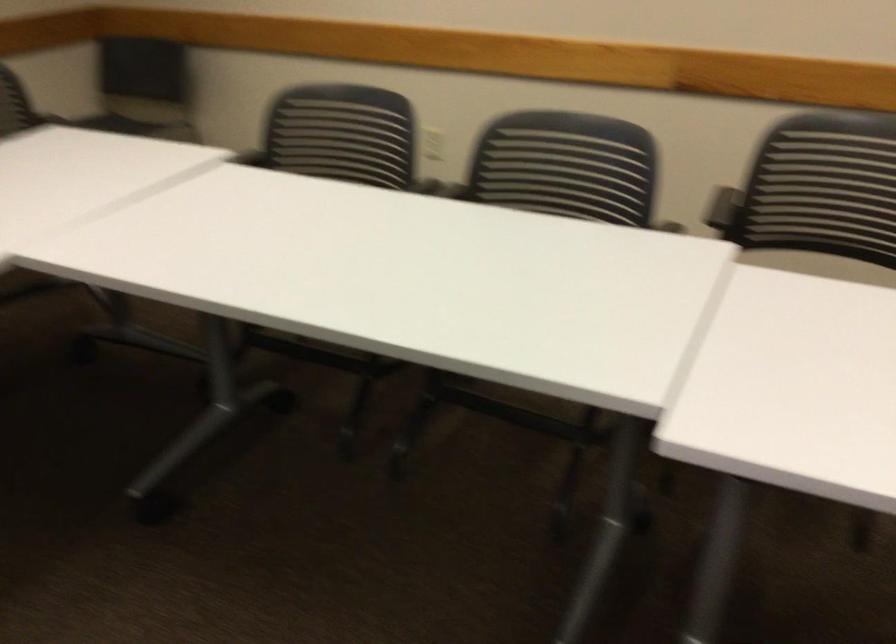
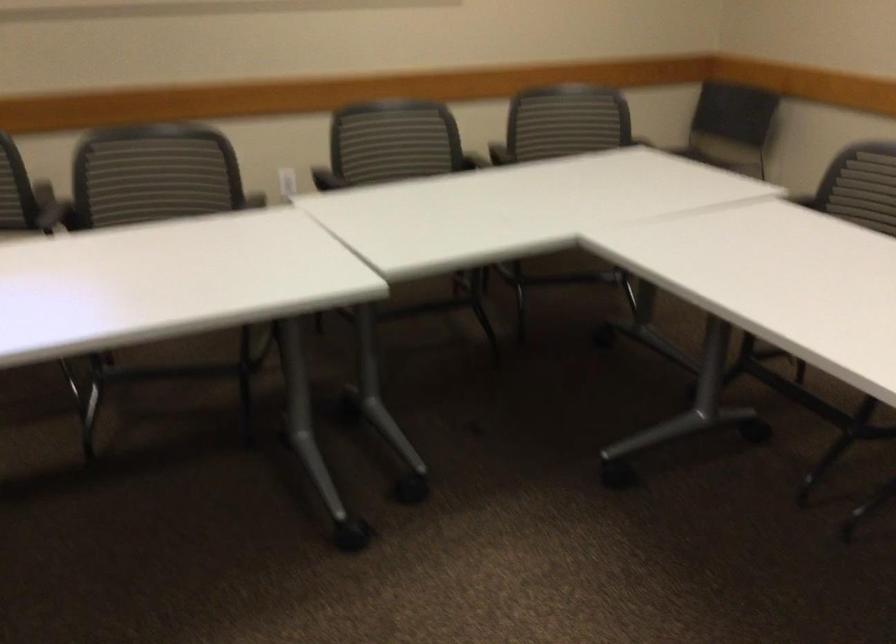
Locate, in the second image, the point that corresponds to (x=315, y=138) in the first image.

(866, 185)